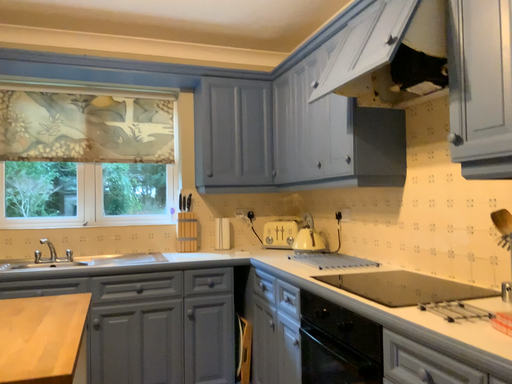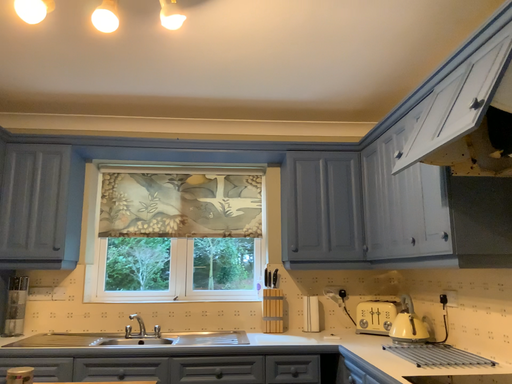
Question: Which way did the camera rotate in the video?

Choices:
 (A) rotated right
 (B) rotated left

Answer: (B)